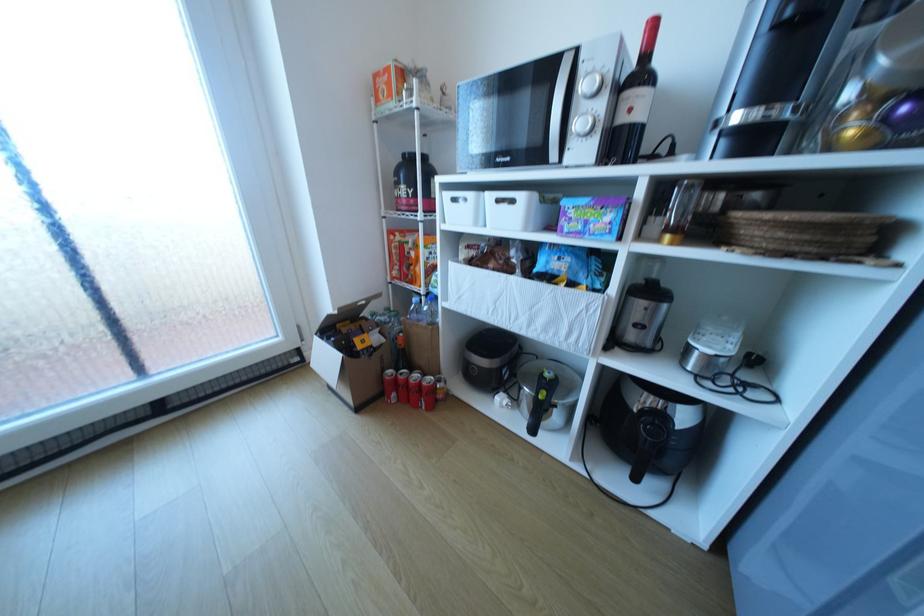
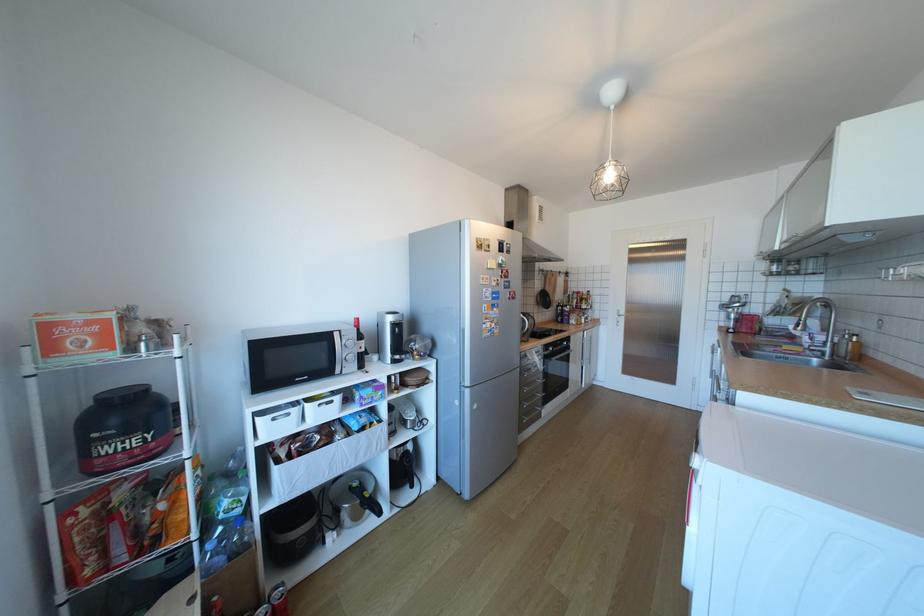
In the second image, find the point that corresponds to point (645, 479) in the first image.

(420, 485)